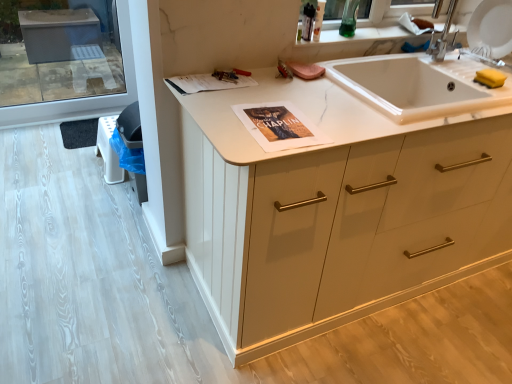
Question: Do you think matte paper magazine at upper center is within white marble sink at center, or outside of it?

Choices:
 (A) outside
 (B) inside

Answer: (A)

Question: In terms of height, does matte paper magazine at upper center look taller or shorter compared to white marble sink at center?

Choices:
 (A) tall
 (B) short

Answer: (B)

Question: Based on their relative distances, which object is nearer to the white matte cabinet at center?

Choices:
 (A) white marble sink at center
 (B) matte paper magazine at upper center

Answer: (A)

Question: Estimate the real-world distances between objects in this image. Which object is closer to the white matte cabinet at center?

Choices:
 (A) white marble sink at center
 (B) matte paper magazine at upper center

Answer: (A)